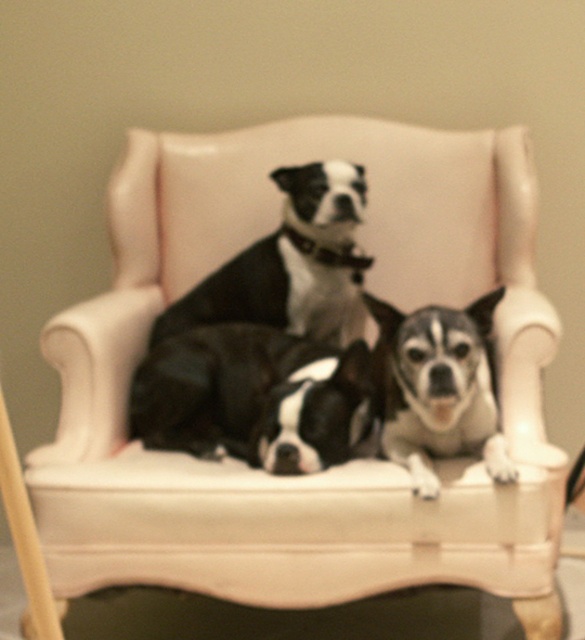
You are sitting on a classic white chair with two dogs. There is a black and white fur at center and a speckled fur dog at center. Which dog is positioned to the left?

The black and white fur at center is positioned to the left of the speckled fur dog at center.

You are a dog trainer observing two dogs on a chair. The black matte dog at center and the speckled fur dog at center. Which dog is sitting higher up on the chair?

The black matte dog at center is located above the speckled fur dog at center, so it is sitting higher up on the chair.